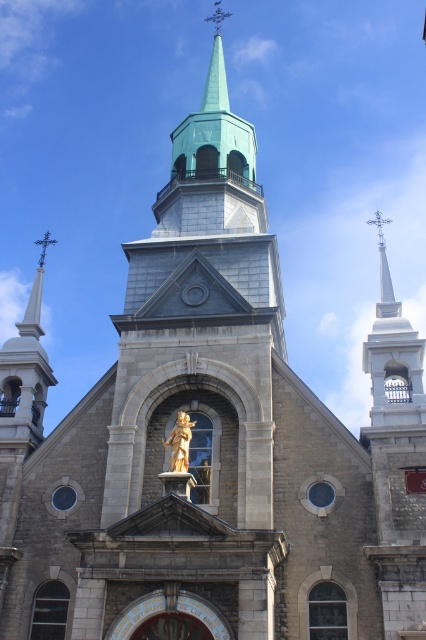
Can you confirm if white stone steeple at upper right is bigger than polished silver spire at upper right?

Yes, white stone steeple at upper right is bigger than polished silver spire at upper right.

Does point (386, 323) come farther from viewer compared to point (373, 221)?

No, it is not.

At what (x,y) coordinates should I click in order to perform the action: click on white stone steeple at upper right. Please return your answer as a coordinate pair (x, y). The image size is (426, 640). Looking at the image, I should click on (393, 355).

Who is more forward, (409,378) or (176,445)?

Point (176,445) is in front.

From the picture: Can you confirm if white stone steeple at upper right is shorter than gold polished statue at center?

No.

You are a GUI agent. You are given a task and a screenshot of the screen. Output one action in this format:
    pyautogui.click(x=<x>, y=<y>)
    Task: Click on the white stone steeple at upper right
    Image resolution: width=426 pixels, height=640 pixels.
    Given the screenshot: What is the action you would take?
    pyautogui.click(x=393, y=355)

Does polished silver spire at upper right have a greater height compared to gold polished statue at center?

Yes.

Is polished silver spire at upper right positioned at the back of gold polished statue at center?

Yes, it is.

The image size is (426, 640). Describe the element at coordinates (383, 272) in the screenshot. I see `polished silver spire at upper right` at that location.

Locate an element on the screen. polished silver spire at upper right is located at coordinates (383, 272).